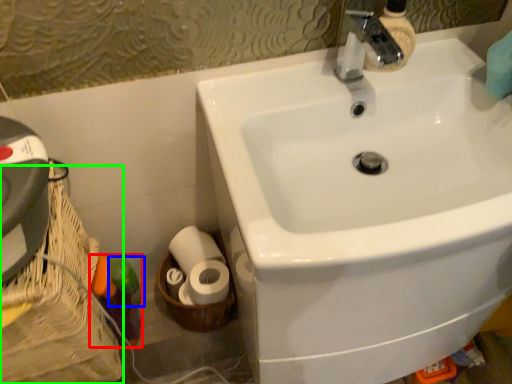
Question: Which object is the farthest from bottle (highlighted by a red box)? Choose among these: toiletry (highlighted by a blue box) or basket container (highlighted by a green box).

Choices:
 (A) toiletry
 (B) basket container

Answer: (B)